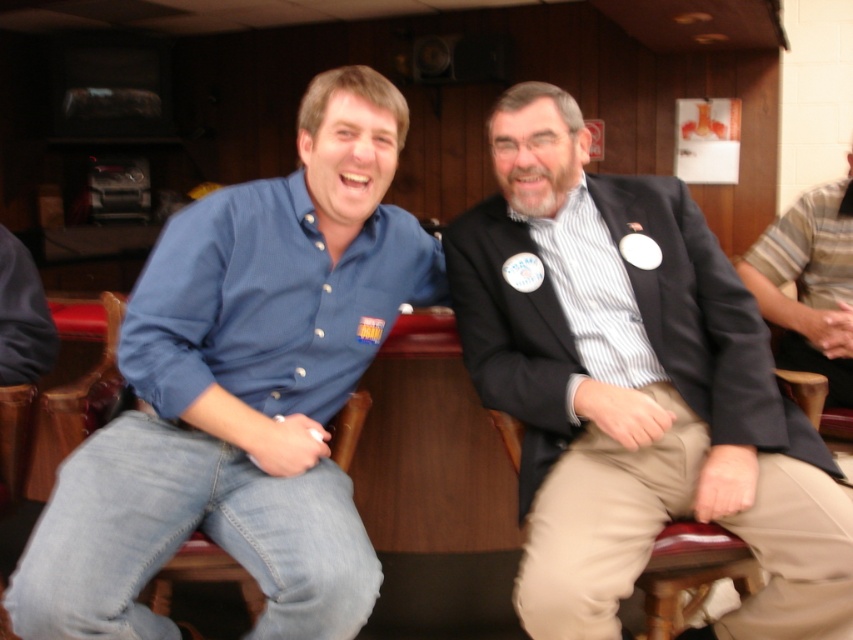
You are a photographer trying to capture a candid shot of both the striped cotton shirt at right and the striped cotton shirt at center. However, you notice that one of them is partially blocking the other. Which striped cotton shirt is blocking the other?

The striped cotton shirt at center is behind striped cotton shirt at right, so the striped cotton shirt at right is blocking the striped cotton shirt at center.

You are a photographer who needs to take a picture of the blue denim jeans at left. The camera is placed at a certain position. Can you reach the camera from where you are standing to capture the jeans?

The blue denim jeans at left and camera are 3.62 feet apart, so you can easily reach the camera to capture the jeans since the distance is manageable.